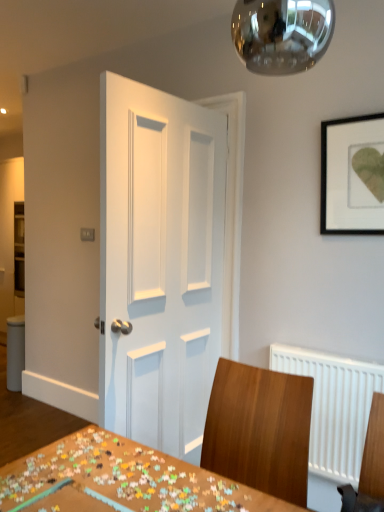
Question: Is wooden chair at center further to camera compared to white painted wood door at center?

Choices:
 (A) yes
 (B) no

Answer: (B)

Question: From a real-world perspective, is wooden chair at center positioned over white painted wood door at center based on gravity?

Choices:
 (A) yes
 (B) no

Answer: (B)

Question: Can you confirm if wooden chair at center is positioned to the right of white painted wood door at center?

Choices:
 (A) no
 (B) yes

Answer: (B)

Question: Considering the relative sizes of wooden chair at center and white painted wood door at center in the image provided, is wooden chair at center wider than white painted wood door at center?

Choices:
 (A) no
 (B) yes

Answer: (B)

Question: From the image's perspective, does wooden chair at center appear lower than white painted wood door at center?

Choices:
 (A) yes
 (B) no

Answer: (A)

Question: From a real-world perspective, is wooden chair at center physically located above or below black matte picture frame at upper right?

Choices:
 (A) above
 (B) below

Answer: (B)

Question: From the image's perspective, relative to black matte picture frame at upper right, is wooden chair at center above or below?

Choices:
 (A) below
 (B) above

Answer: (A)

Question: Is wooden chair at center inside or outside of black matte picture frame at upper right?

Choices:
 (A) outside
 (B) inside

Answer: (A)

Question: Considering their positions, is wooden chair at center located in front of or behind black matte picture frame at upper right?

Choices:
 (A) behind
 (B) front

Answer: (B)

Question: Is white painted wood door at center inside the boundaries of wooden chair at center, or outside?

Choices:
 (A) inside
 (B) outside

Answer: (B)

Question: From their relative heights in the image, would you say white painted wood door at center is taller or shorter than wooden chair at center?

Choices:
 (A) short
 (B) tall

Answer: (B)

Question: From a real-world perspective, relative to wooden chair at center, is white painted wood door at center vertically above or below?

Choices:
 (A) below
 (B) above

Answer: (B)

Question: Looking at their shapes, would you say white painted wood door at center is wider or thinner than wooden chair at center?

Choices:
 (A) wide
 (B) thin

Answer: (B)

Question: From a real-world perspective, is white painted wood door at center above or below wooden puzzle pieces at center?

Choices:
 (A) below
 (B) above

Answer: (B)

Question: Considering the positions of white painted wood door at center and wooden puzzle pieces at center in the image, is white painted wood door at center wider or thinner than wooden puzzle pieces at center?

Choices:
 (A) thin
 (B) wide

Answer: (A)